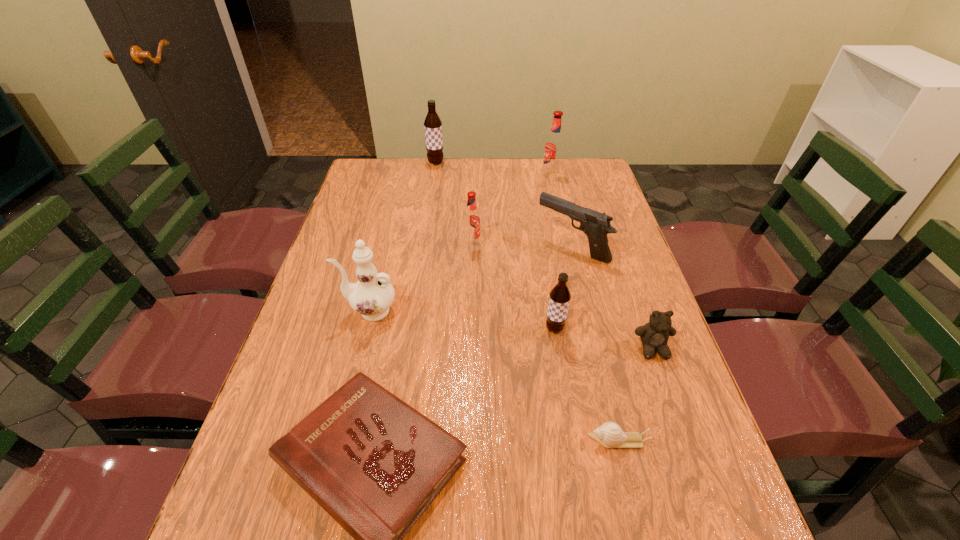
Locate an element on the screen. escargot at the right edge is located at coordinates (610, 435).

The height and width of the screenshot is (540, 960). I want to click on object that is at the far right corner, so click(554, 145).

Identify the location of vacant space at the far edge of the desktop. (417, 181).

You are a GUI agent. You are given a task and a screenshot of the screen. Output one action in this format:
    pyautogui.click(x=<x>, y=<y>)
    Task: Click on the free space at the left edge of the desktop
    The width and height of the screenshot is (960, 540).
    Given the screenshot: What is the action you would take?
    pyautogui.click(x=244, y=480)

Where is `vacant space at the right edge of the desktop`? vacant space at the right edge of the desktop is located at coordinates (674, 522).

Find the location of `free space at the far right corner`. free space at the far right corner is located at coordinates (562, 183).

I want to click on empty space between the shortest object and the farther red root beer, so tap(585, 308).

Locate an element on the screen. This screenshot has height=540, width=960. vacant space that's between the chinaware and the right red root beer is located at coordinates (460, 243).

You are a GUI agent. You are given a task and a screenshot of the screen. Output one action in this format:
    pyautogui.click(x=<x>, y=<y>)
    Task: Click on the blank region between the third shortest object and the black gun
    Image resolution: width=960 pixels, height=540 pixels.
    Given the screenshot: What is the action you would take?
    pyautogui.click(x=612, y=298)

What are the coordinates of `vacant space that's between the leftmost root beer and the nearer brown root beer` in the screenshot? It's located at (495, 246).